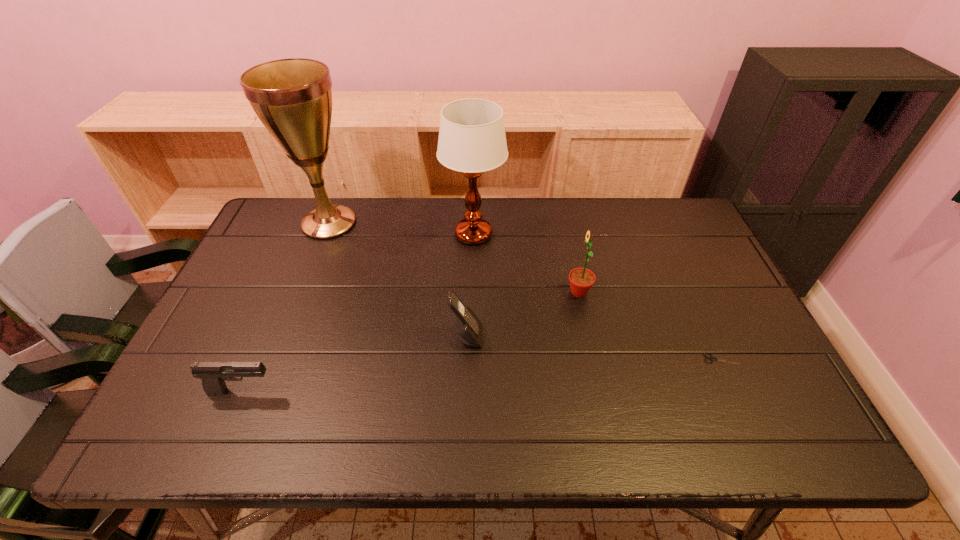
The image size is (960, 540). I want to click on trophy cup that is at the left edge, so click(x=292, y=97).

Find the location of a particular element. This screenshot has width=960, height=540. pistol at the left edge is located at coordinates (213, 374).

Image resolution: width=960 pixels, height=540 pixels. In order to click on object located at the right edge in this screenshot , I will do `click(711, 358)`.

The height and width of the screenshot is (540, 960). In order to click on object at the far left corner in this screenshot , I will do `click(292, 97)`.

The image size is (960, 540). What are the coordinates of `vacant space at the far edge of the desktop` in the screenshot? It's located at (490, 204).

The height and width of the screenshot is (540, 960). I want to click on vacant space at the near edge of the desktop, so click(x=387, y=423).

Image resolution: width=960 pixels, height=540 pixels. In the image, there is a desktop. Find the location of `vacant space at the left edge`. vacant space at the left edge is located at coordinates (261, 348).

The height and width of the screenshot is (540, 960). In the image, there is a desktop. What are the coordinates of `blank space at the right edge` in the screenshot? It's located at (717, 297).

Image resolution: width=960 pixels, height=540 pixels. Identify the location of free space at the far left corner. (283, 240).

You are a GUI agent. You are given a task and a screenshot of the screen. Output one action in this format:
    pyautogui.click(x=<x>, y=<y>)
    Task: Click on the unoccupied area between the fifth object from left to right and the third nearest object
    The image size is (960, 540).
    Given the screenshot: What is the action you would take?
    pyautogui.click(x=522, y=314)